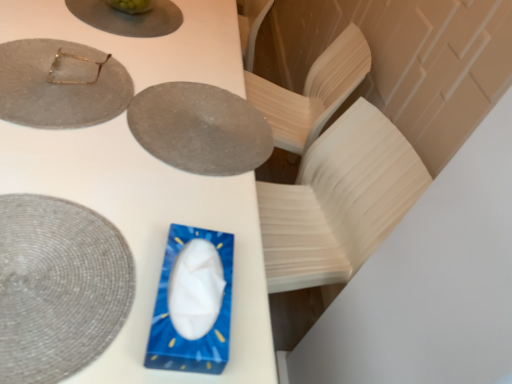
This screenshot has height=384, width=512. I want to click on vacant point above matte gray placemat at lower left, marked as the first plate in a bottom-to-top arrangement (from a real-world perspective), so click(56, 271).